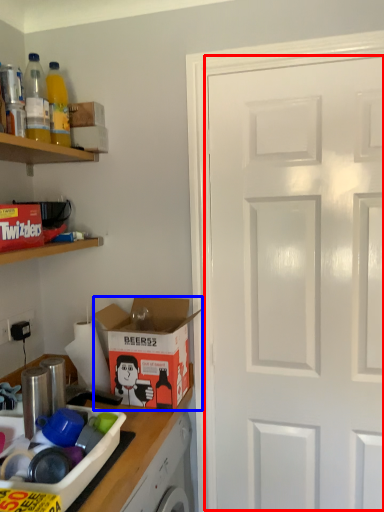
Question: Which object appears closest to the camera in this image, door (highlighted by a red box) or cardboard box (highlighted by a blue box)?

Choices:
 (A) door
 (B) cardboard box

Answer: (A)